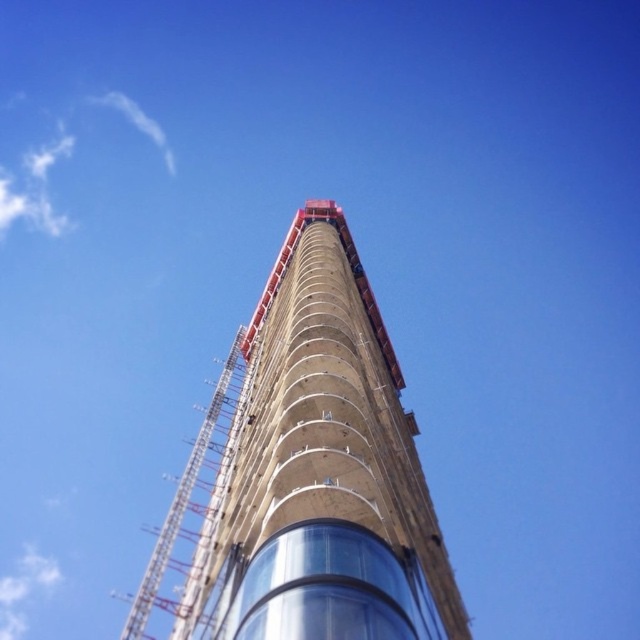
Is concrete at center behind metallic scaffolding at center?

No, it is not.

Is point (400, 465) farther from viewer compared to point (168, 524)?

Yes, point (400, 465) is farther from viewer.

In order to click on concrete at center in this screenshot , I will do `click(320, 470)`.